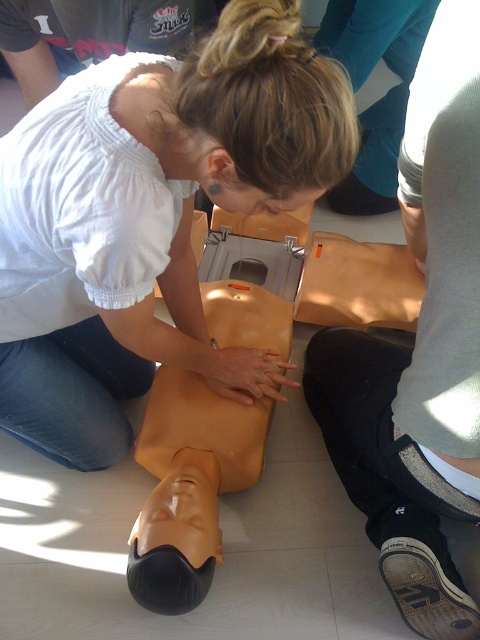
Looking at this image, which of these two, matte yellow mannequin at center or matte orange mannequin torso at center, stands shorter?

matte yellow mannequin at center is shorter.

Does matte yellow mannequin at center have a larger size compared to matte orange mannequin torso at center?

Indeed, matte yellow mannequin at center has a larger size compared to matte orange mannequin torso at center.

At what (x,y) coordinates should I click in order to perform the action: click on matte yellow mannequin at center. Please return your answer as a coordinate pair (x, y). The width and height of the screenshot is (480, 640). Looking at the image, I should click on (149, 218).

Who is positioned more to the left, matte yellow mannequin at center or brown canvas shoe at lower right?

matte yellow mannequin at center is more to the left.

Is point (132, 332) closer to viewer compared to point (420, 616)?

That is True.

Find the location of a particular element. matte yellow mannequin at center is located at coordinates (149, 218).

Does matte orange mannequin torso at center have a larger size compared to brown canvas shoe at lower right?

Correct, matte orange mannequin torso at center is larger in size than brown canvas shoe at lower right.

Measure the distance between matte orange mannequin torso at center and brown canvas shoe at lower right.

They are 9.33 inches apart.

Identify the location of matte orange mannequin torso at center. (420, 349).